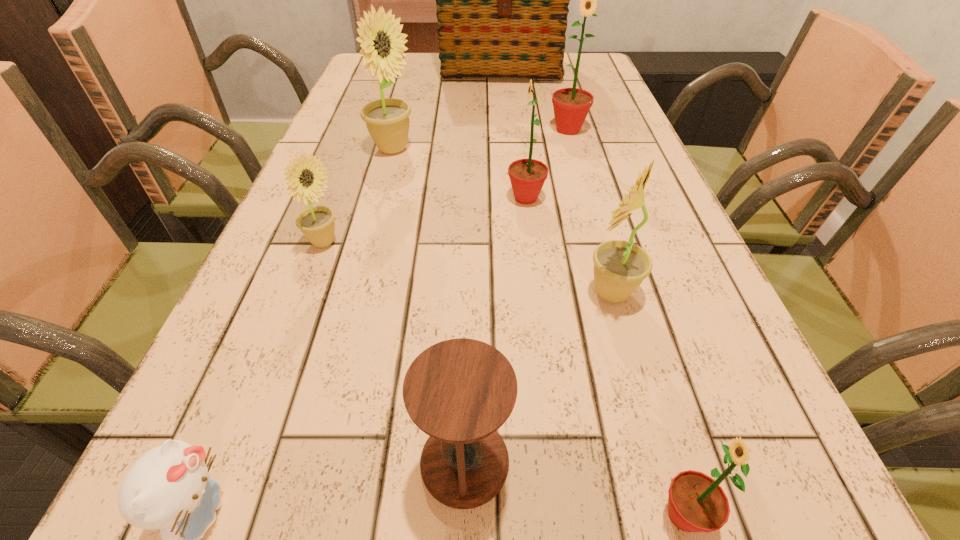
I want to click on the second closest green sunflower relative to the second smallest green sunflower, so click(x=697, y=503).

Locate an element on the screen. This screenshot has width=960, height=540. blank area in the image that satisfies the following two spatial constraints: 1. on the face of the leftmost green sunflower; 2. on the front side of the hourglass is located at coordinates (558, 462).

This screenshot has height=540, width=960. I want to click on vacant space that satisfies the following two spatial constraints: 1. on the open handle side of the farthest object; 2. on the face of the farthest yellow sunflower, so click(506, 149).